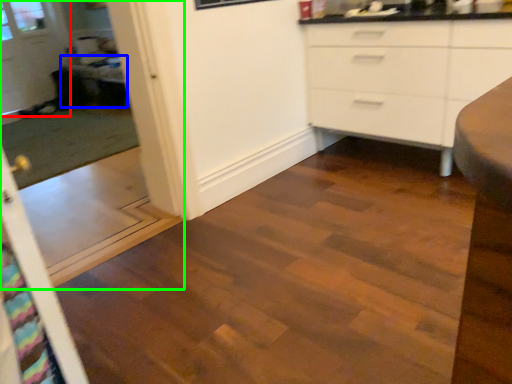
Question: Considering the real-world distances, which object is closest to glass door (highlighted by a red box)? table (highlighted by a blue box) or screen door (highlighted by a green box).

Choices:
 (A) table
 (B) screen door

Answer: (B)